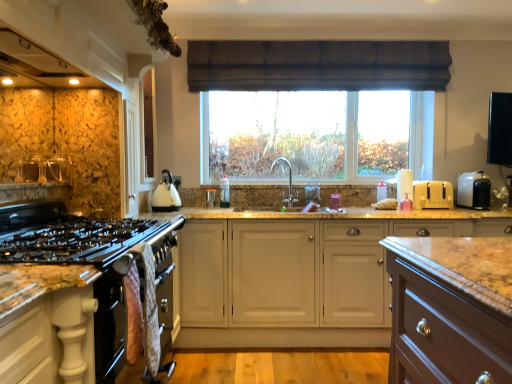
Image resolution: width=512 pixels, height=384 pixels. What are the coordinates of `vacant space situated above brown fabric curtain at upper center (from a real-world perspective)` in the screenshot? It's located at (328, 36).